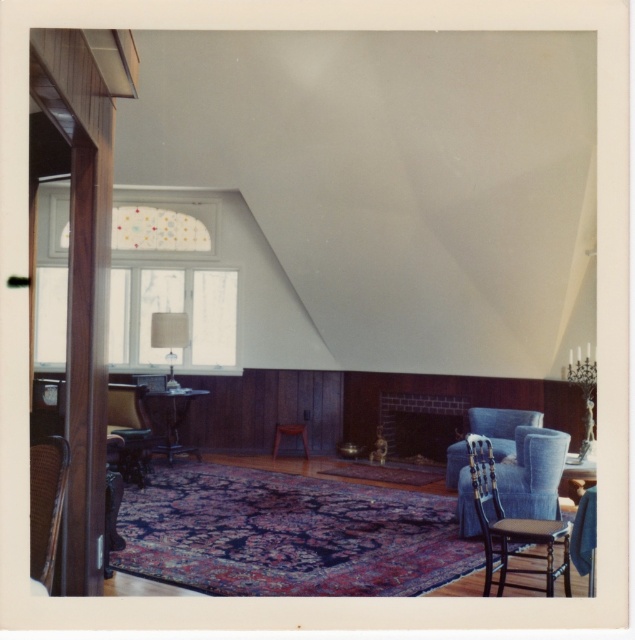
Can you confirm if brick fireplace at center is positioned below velvet blue armchair at center?

Yes.

I want to click on brick fireplace at center, so point(422,422).

Measure the distance between point (422, 424) and camera.

The distance of point (422, 424) from camera is 8.50 meters.

Locate an element on the screen. Image resolution: width=635 pixels, height=640 pixels. brick fireplace at center is located at coordinates (422, 422).

Is wooden chair at lower right bigger than wooden chair at lower left?

Yes, wooden chair at lower right is bigger than wooden chair at lower left.

Is point (490, 464) less distant than point (123, 449)?

Yes, it is.

Locate an element on the screen. The width and height of the screenshot is (635, 640). wooden chair at lower right is located at coordinates (511, 528).

Where is `wooden chair at lower right`? This screenshot has width=635, height=640. wooden chair at lower right is located at coordinates (511, 528).

What do you see at coordinates (130, 429) in the screenshot? The width and height of the screenshot is (635, 640). I see `wooden chair at lower left` at bounding box center [130, 429].

Is wooden chair at lower left to the left of velvet blue armchair at center from the viewer's perspective?

Correct, you'll find wooden chair at lower left to the left of velvet blue armchair at center.

Identify the location of wooden chair at lower left. Image resolution: width=635 pixels, height=640 pixels. [x=130, y=429].